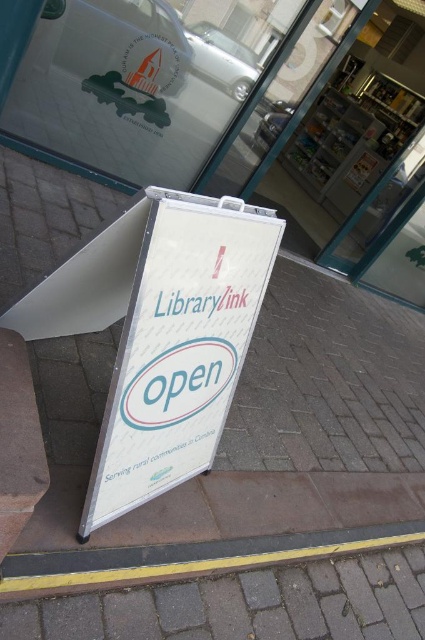
Is white plastic sign at center shorter than yellow rubber at lower center?

Incorrect, white plastic sign at center's height does not fall short of yellow rubber at lower center's.

In the scene shown: Can you confirm if white plastic sign at center is positioned above yellow rubber at lower center?

Indeed, white plastic sign at center is positioned over yellow rubber at lower center.

This screenshot has height=640, width=425. Describe the element at coordinates (180, 348) in the screenshot. I see `white plastic sign at center` at that location.

Find the location of a particular element. The width and height of the screenshot is (425, 640). white plastic sign at center is located at coordinates (180, 348).